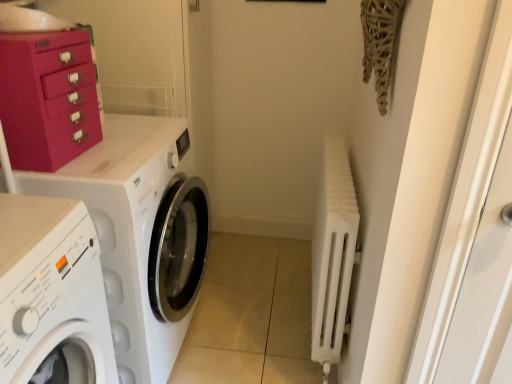
Question: Is white glossy washing machine at left, acting as the 2th washing machine starting from the front, positioned with its back to white matte washing machine at left, which is the 1th washing machine in front-to-back order?

Choices:
 (A) yes
 (B) no

Answer: (B)

Question: Could you tell me if white glossy washing machine at left, the 1th washing machine from the back, is turned towards white matte washing machine at left, the 2th washing machine viewed from the back?

Choices:
 (A) yes
 (B) no

Answer: (B)

Question: Considering the relative sizes of white glossy washing machine at left, acting as the 2th washing machine starting from the front, and white matte washing machine at left, which is the 1th washing machine in front-to-back order, in the image provided, is white glossy washing machine at left, acting as the 2th washing machine starting from the front, shorter than white matte washing machine at left, which is the 1th washing machine in front-to-back order,?

Choices:
 (A) no
 (B) yes

Answer: (A)

Question: Is white glossy washing machine at left, the 1th washing machine from the back, to the left of white matte washing machine at left, which is the 1th washing machine in front-to-back order, from the viewer's perspective?

Choices:
 (A) yes
 (B) no

Answer: (B)

Question: Would you say white glossy washing machine at left, the 1th washing machine from the back, is outside white matte washing machine at left, the 2th washing machine viewed from the back?

Choices:
 (A) yes
 (B) no

Answer: (A)

Question: Is white matte radiator at right in front of or behind white glossy washing machine at left, acting as the 2th washing machine starting from the front, in the image?

Choices:
 (A) front
 (B) behind

Answer: (B)

Question: Considering the positions of point (330, 251) and point (161, 163), is point (330, 251) closer or farther from the camera than point (161, 163)?

Choices:
 (A) closer
 (B) farther

Answer: (A)

Question: In terms of width, does white matte radiator at right look wider or thinner when compared to white glossy washing machine at left, the 1th washing machine from the back?

Choices:
 (A) wide
 (B) thin

Answer: (B)

Question: Would you say white matte radiator at right is to the left or to the right of white glossy washing machine at left, acting as the 2th washing machine starting from the front, in the picture?

Choices:
 (A) right
 (B) left

Answer: (A)

Question: Is white matte washing machine at left, the 2th washing machine viewed from the back, bigger or smaller than white glossy washing machine at left, acting as the 2th washing machine starting from the front?

Choices:
 (A) small
 (B) big

Answer: (A)

Question: In the image, is white matte washing machine at left, which is the 1th washing machine in front-to-back order, positioned in front of or behind white glossy washing machine at left, the 1th washing machine from the back?

Choices:
 (A) behind
 (B) front

Answer: (B)

Question: Visually, is white matte washing machine at left, which is the 1th washing machine in front-to-back order, positioned to the left or to the right of white glossy washing machine at left, acting as the 2th washing machine starting from the front?

Choices:
 (A) left
 (B) right

Answer: (A)

Question: Do you think white matte washing machine at left, the 2th washing machine viewed from the back, is within white glossy washing machine at left, acting as the 2th washing machine starting from the front, or outside of it?

Choices:
 (A) inside
 (B) outside

Answer: (B)

Question: Is matte pink cabinet at upper left wider or thinner than white matte radiator at right?

Choices:
 (A) thin
 (B) wide

Answer: (B)

Question: Is matte pink cabinet at upper left to the left or to the right of white matte radiator at right in the image?

Choices:
 (A) left
 (B) right

Answer: (A)